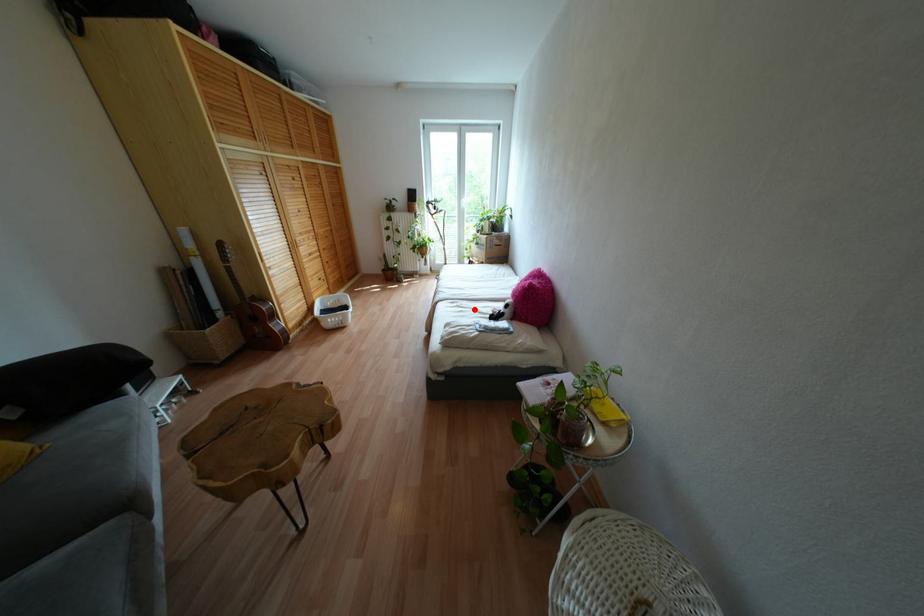
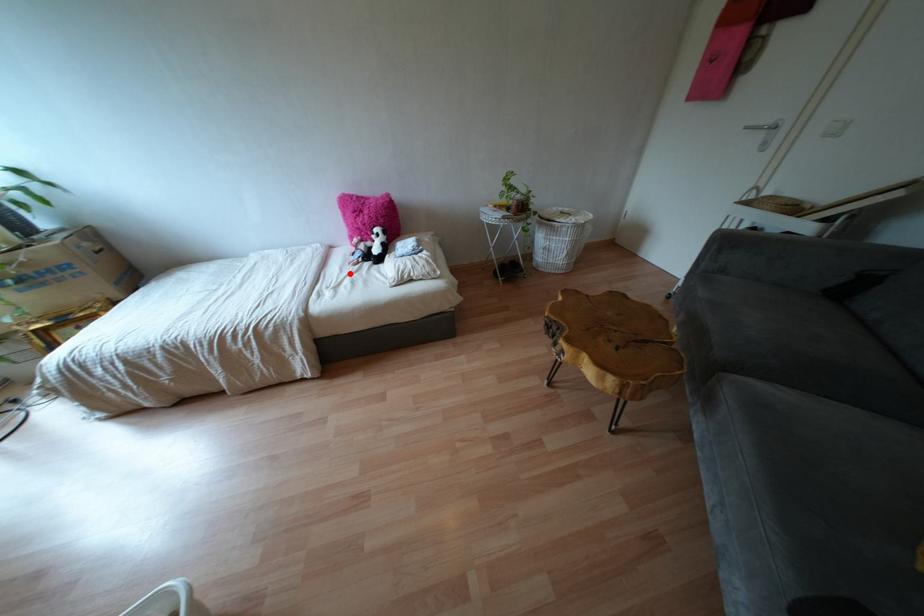
I am providing you with two images of the same scene from different viewpoints. A red point is marked on the first image and another point is marked on the second image. Is the marked point in image1 the same physical position as the marked point in image2?

Yes